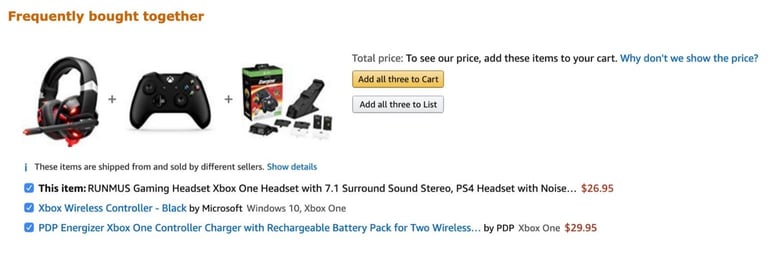
Identify the location of box. (262, 83).